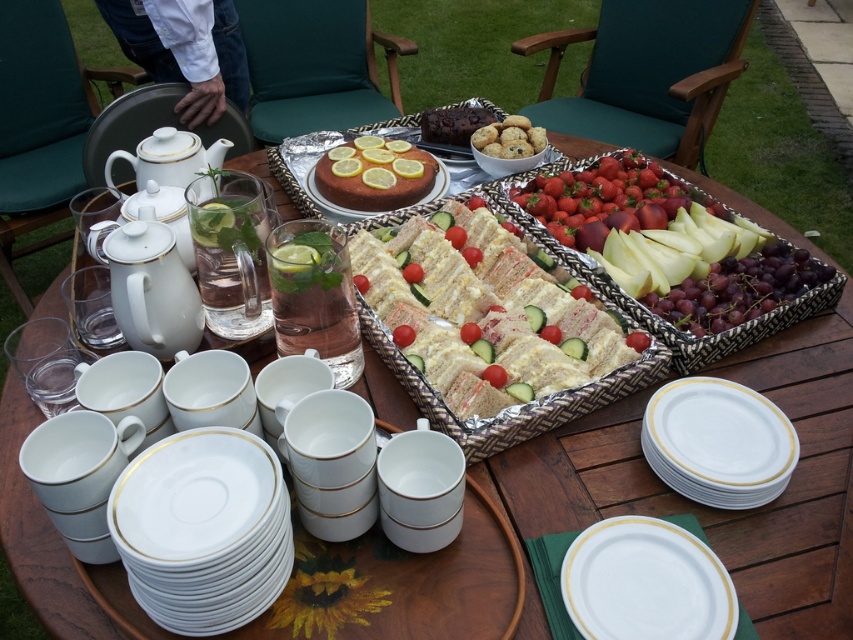
Question: Which of the following is the farthest from the observer?

Choices:
 (A) white porcelain teapot at upper left
 (B) matte brown cake at center

Answer: (B)

Question: Is white porcelain teapot at upper left thinner than chocolate chip cookie dough balls at upper center?

Choices:
 (A) no
 (B) yes

Answer: (A)

Question: Can you confirm if white porcelain plates at lower left is positioned below shiny red strawberries at center?

Choices:
 (A) yes
 (B) no

Answer: (A)

Question: Which point is farther from the camera taking this photo?

Choices:
 (A) 753,502
 (B) 212,145
 (C) 495,141
 (D) 305,186

Answer: (B)

Question: Which point is farther to the camera?

Choices:
 (A) (672, 628)
 (B) (701, 449)

Answer: (B)

Question: Is white ceramic plates at lower right above white porcelain teapot at upper left?

Choices:
 (A) yes
 (B) no

Answer: (B)